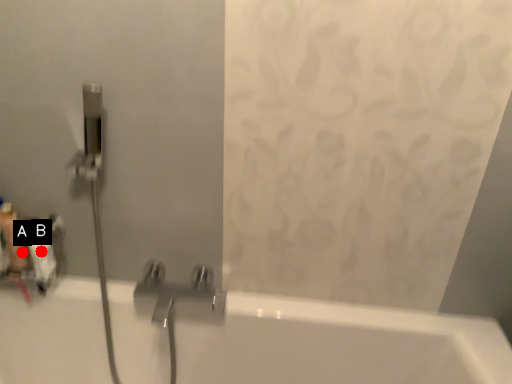
Question: Two points are circled on the image, labeled by A and B beside each circle. Among these points, which one is farthest from the camera?

Choices:
 (A) A is further
 (B) B is further

Answer: (A)